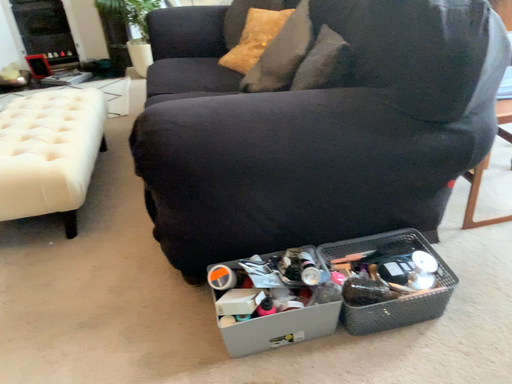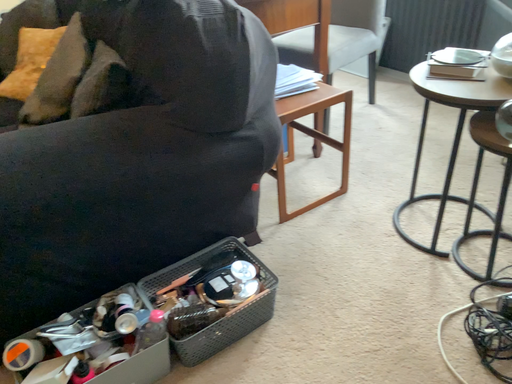
Question: How did the camera likely rotate when shooting the video?

Choices:
 (A) rotated left
 (B) rotated right

Answer: (B)